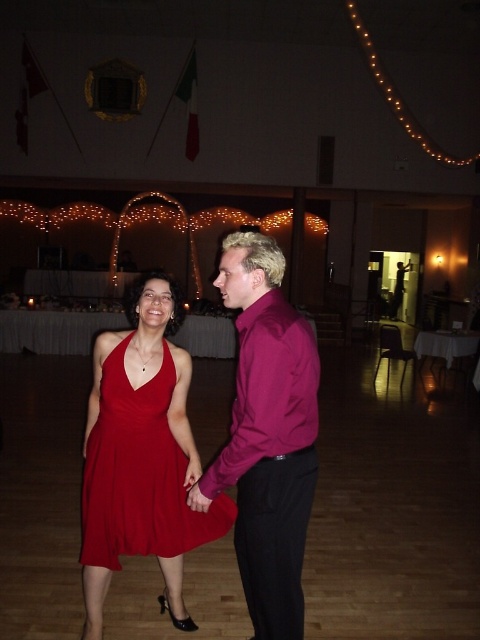
Is shiny magenta shirt at center bigger than matte red dress at center?

Yes, shiny magenta shirt at center is bigger than matte red dress at center.

Which of these two, shiny magenta shirt at center or matte red dress at center, stands taller?

Standing taller between the two is shiny magenta shirt at center.

Between point (249, 538) and point (91, 525), which one is positioned in front?

Point (249, 538) is in front.

Where is `shiny magenta shirt at center`? shiny magenta shirt at center is located at coordinates (266, 435).

Is shiny magenta shirt at center smaller than purple satin shirt at center?

No.

How distant is shiny magenta shirt at center from purple satin shirt at center?

shiny magenta shirt at center is 4.63 inches from purple satin shirt at center.

I want to click on shiny magenta shirt at center, so coord(266,435).

Where is `shiny magenta shirt at center`? shiny magenta shirt at center is located at coordinates (266, 435).

Does matte red dress at center have a greater height compared to purple satin shirt at center?

Correct, matte red dress at center is much taller as purple satin shirt at center.

Is matte red dress at center shorter than purple satin shirt at center?

Incorrect, matte red dress at center's height does not fall short of purple satin shirt at center's.

Measure the distance between point (x=105, y=388) and camera.

The distance of point (x=105, y=388) from camera is 7.66 feet.

This screenshot has height=640, width=480. I want to click on matte red dress at center, so click(x=140, y=474).